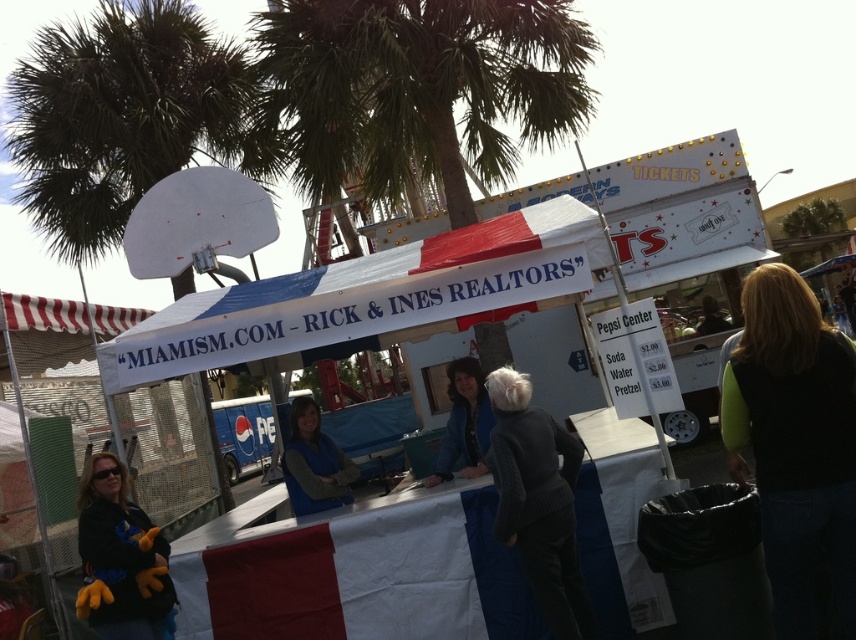
Looking at this image, you are at the outdoor event and want to take a photo of the green leafy palm tree at upper left and the green fleece vest at lower right. Which object should you focus on first if you want to capture both in one frame without moving the camera?

You should focus on the green leafy palm tree at upper left first because it is located above the green fleece vest at lower right, so adjusting the camera to include both would require ensuring the upper area captures the palm tree while the lower part includes the vest.